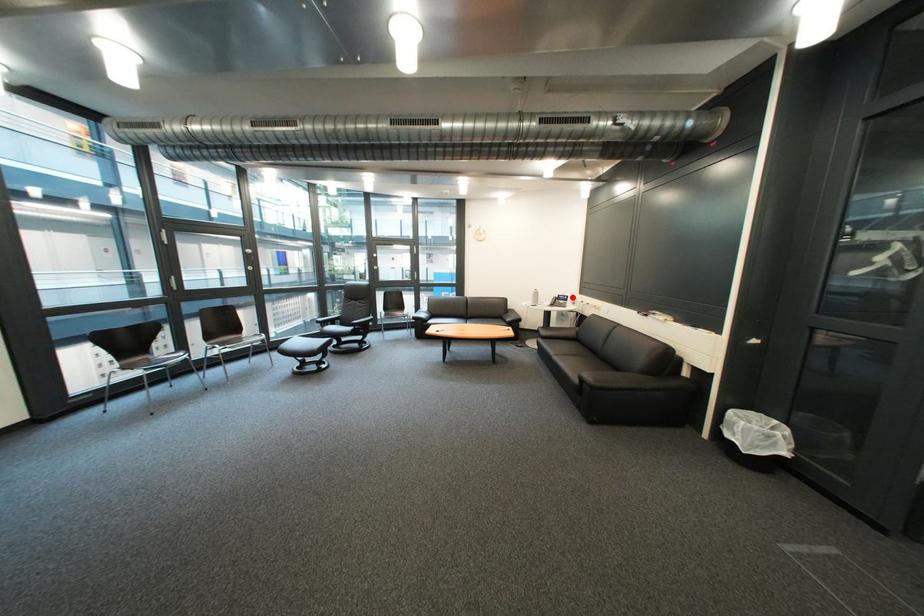
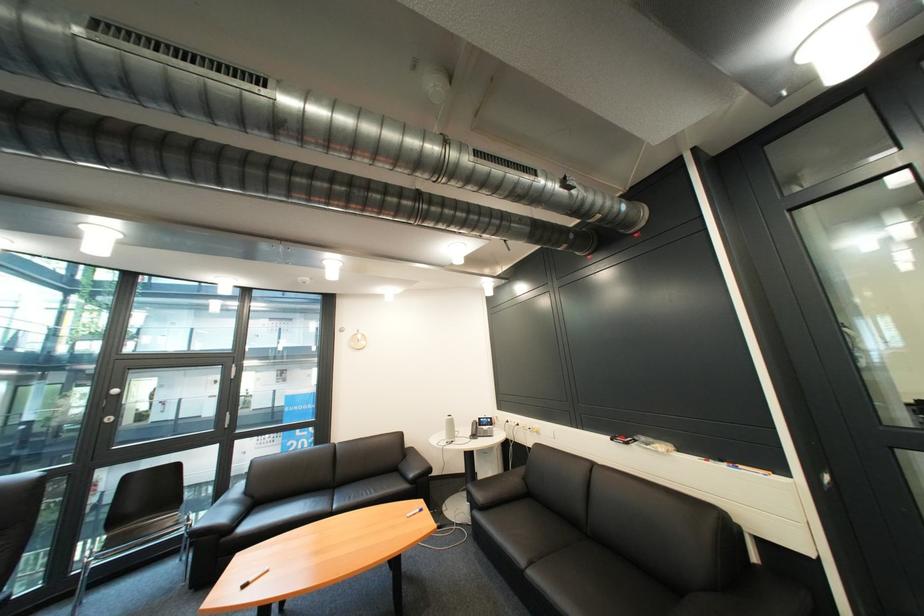
The point at the highlighted location is marked in the first image. Where is the corresponding point in the second image?

(492, 419)